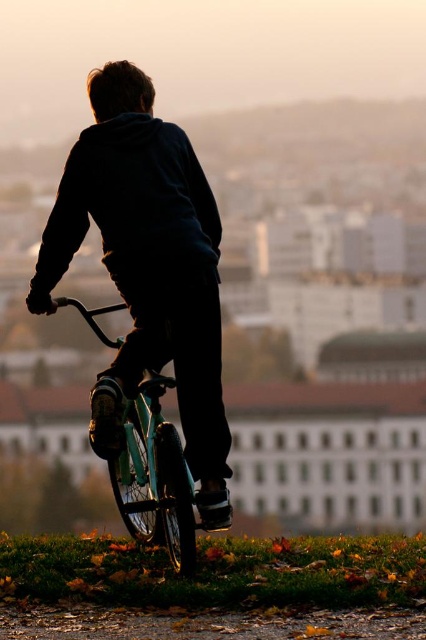
You are a fashion designer observing the scene. You need to determine which item, the dark blue hoodie at center or the teal matte bicycle at center, requires more fabric to produce. Based on the information provided, which one would you choose?

The dark blue hoodie at center is bigger than the teal matte bicycle at center, so the dark blue hoodie at center requires more fabric to produce.

You are a photographer trying to capture the scene of a person sitting on a bicycle. You notice the dark blue hoodie at center and the teal matte bicycle at center. Which object should you focus on first if you want to ensure both are in sharp focus?

The dark blue hoodie at center is located above the teal matte bicycle at center. To ensure both are in sharp focus, you should focus on the dark blue hoodie at center first as it is closer to the camera, allowing the depth of field to cover the bicycle below it.